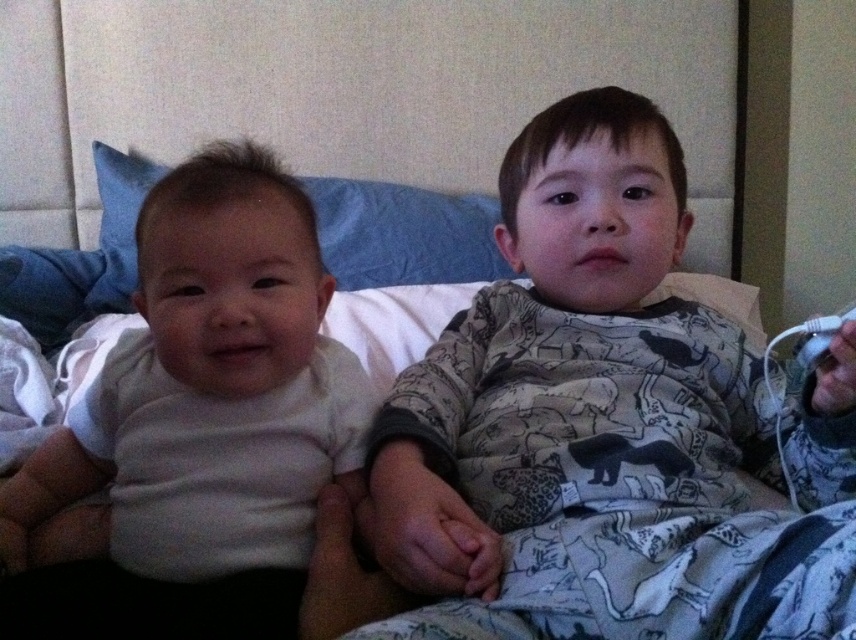
What is located at the coordinate point (607, 428) in the image?

The printed cotton pajamas at center are located at the coordinate point (607, 428).

Based on the scene description, where exactly is the printed cotton pajamas at center located in terms of coordinates?

The printed cotton pajamas at center are located at coordinates point (607, 428).